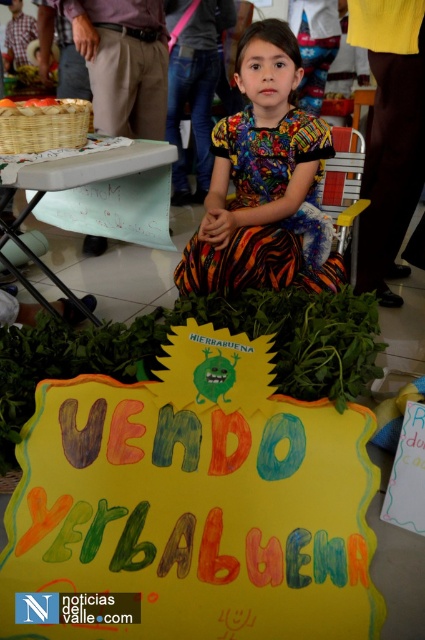
Does multicolored fabric dress at center appear over green painted plastic table at lower left?

Indeed, multicolored fabric dress at center is positioned over green painted plastic table at lower left.

Does multicolored fabric dress at center lie behind green painted plastic table at lower left?

Yes, multicolored fabric dress at center is further from the viewer.

Identify the location of multicolored fabric dress at center. (x=265, y=182).

Is hand-painted cardboard sign at center positioned behind multicolored fabric dress at center?

No, hand-painted cardboard sign at center is closer to the viewer.

Describe the element at coordinates (190, 506) in the screenshot. The image size is (425, 640). I see `hand-painted cardboard sign at center` at that location.

Which is in front, point (127, 576) or point (266, 285)?

Point (127, 576) is in front.

Locate an element on the screen. This screenshot has width=425, height=640. hand-painted cardboard sign at center is located at coordinates (190, 506).

Can you confirm if hand-painted cardboard sign at center is smaller than green painted plastic table at lower left?

Actually, hand-painted cardboard sign at center might be larger than green painted plastic table at lower left.

Is hand-painted cardboard sign at center further to camera compared to green painted plastic table at lower left?

No, hand-painted cardboard sign at center is in front of green painted plastic table at lower left.

Does point (238, 563) lie behind point (20, 248)?

No, (238, 563) is closer to viewer.

Find the location of a particular element. This screenshot has width=425, height=640. hand-painted cardboard sign at center is located at coordinates (190, 506).